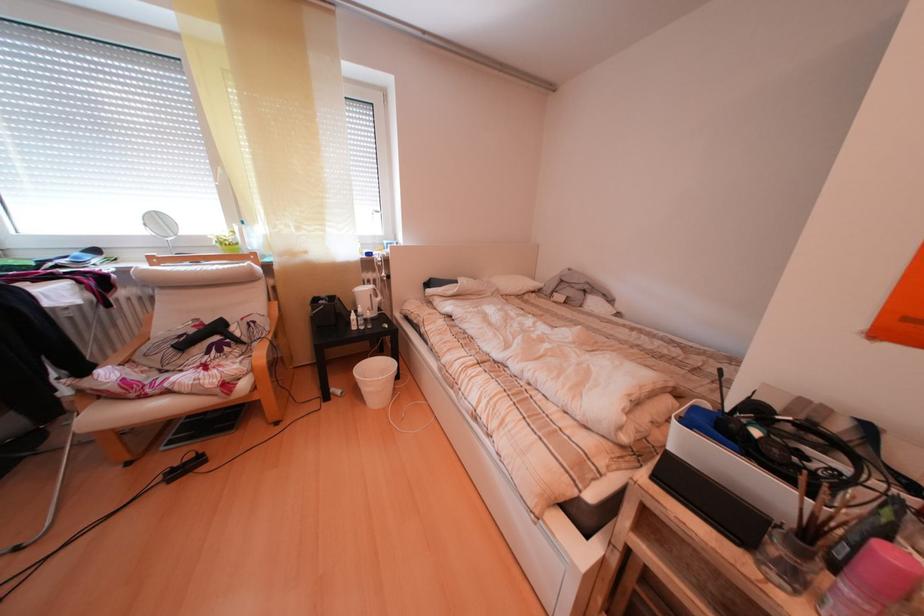
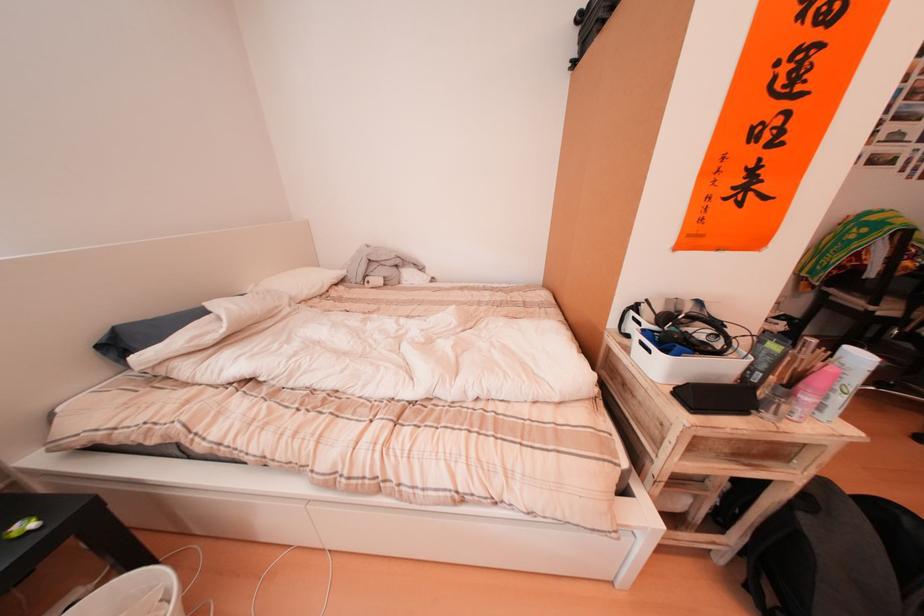
Question: I am providing you with two images of the same scene from different viewpoints. Which of the following objects are not visible in image2?

Choices:
 (A) grey stuffed animal
 (B) pink plastic bottle
 (C) black headphones
 (D) none of these

Answer: (D)